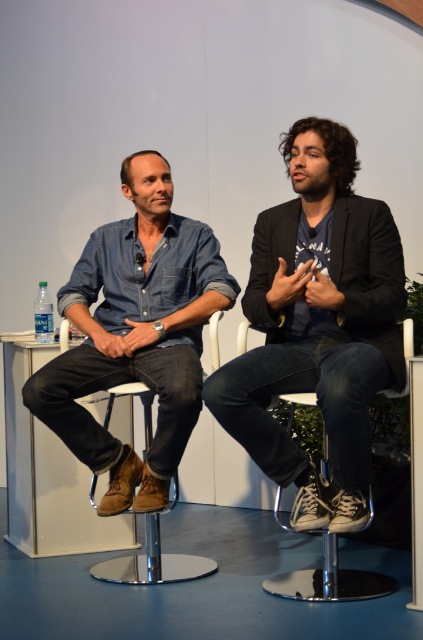
Is point (384, 211) behind point (125, 580)?

No, it is not.

Can you confirm if dark blue denim jeans at center is positioned to the right of brown leather stool at center?

Correct, you'll find dark blue denim jeans at center to the right of brown leather stool at center.

Between point (255, 410) and point (90, 502), which one is positioned behind?

The point (90, 502) is behind.

You are a GUI agent. You are given a task and a screenshot of the screen. Output one action in this format:
    pyautogui.click(x=<x>, y=<y>)
    Task: Click on the dark blue denim jeans at center
    The image size is (423, 640).
    Given the screenshot: What is the action you would take?
    pyautogui.click(x=318, y=324)

Does dark blue denim jeans at center have a smaller size compared to denim shirt at left?

No, dark blue denim jeans at center is not smaller than denim shirt at left.

Which is behind, point (227, 380) or point (115, 509)?

The point (115, 509) is behind.

Does point (315, 346) come behind point (120, 465)?

No.

I want to click on dark blue denim jeans at center, so click(318, 324).

Is denim shirt at left below brown leather stool at center?

No.

Identify the location of denim shirt at left. This screenshot has height=640, width=423. (136, 333).